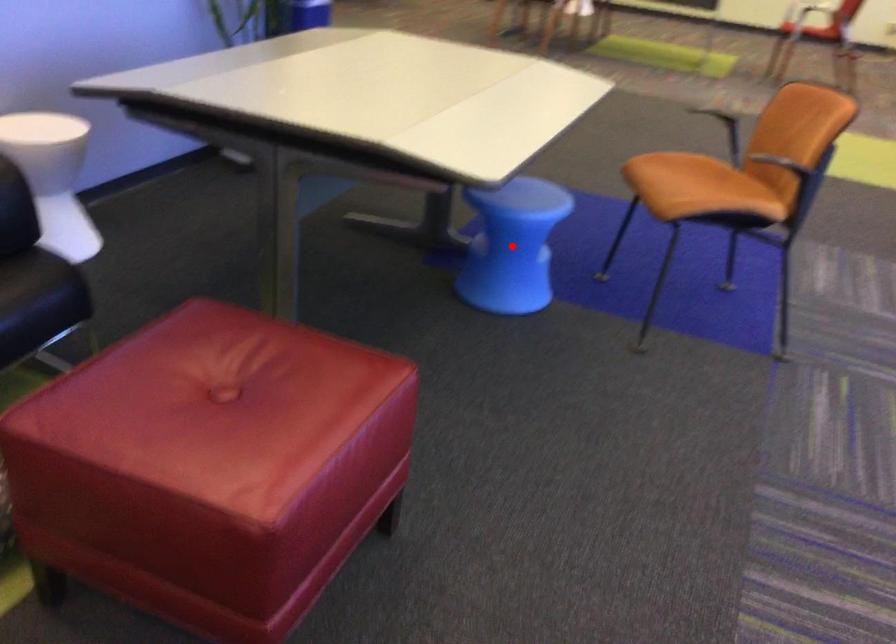
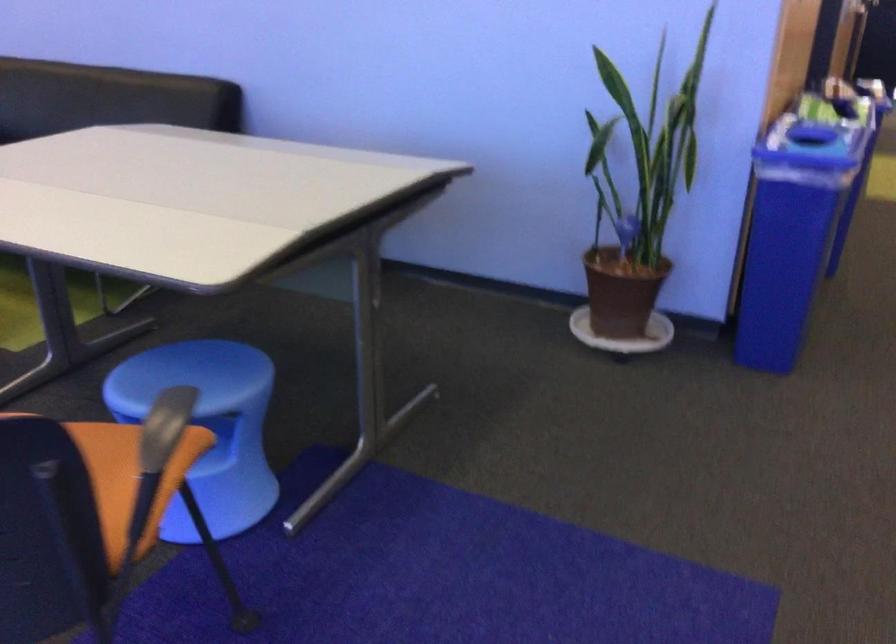
Question: I am providing you with two images of the same scene from different viewpoints. A red point is marked on the first image. At the location where the point appears in image 1, is it still visible in image 2?

Choices:
 (A) Yes
 (B) No

Answer: (B)